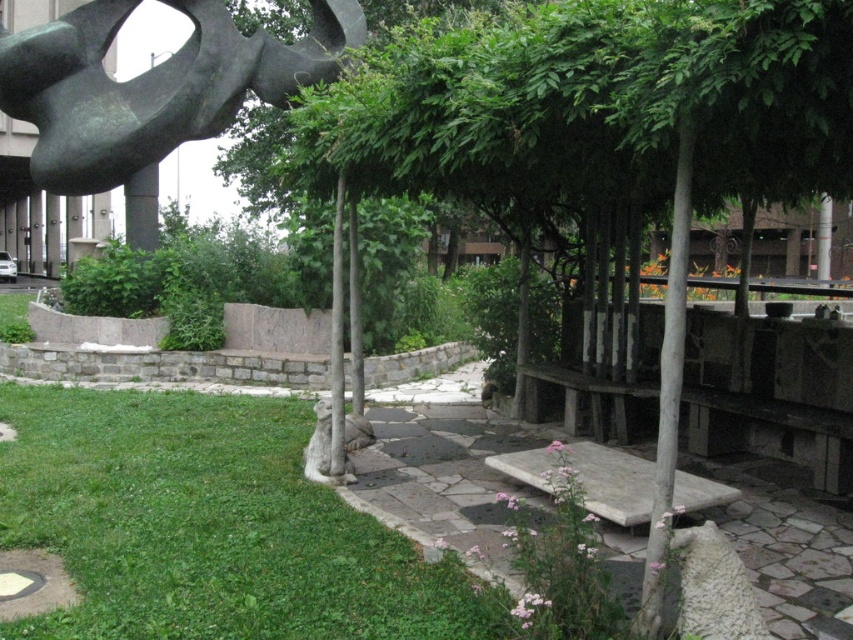
Question: In this image, where is green grass at lower left located relative to bronze sculpture at upper left?

Choices:
 (A) left
 (B) right

Answer: (B)

Question: Which point is farther to the camera?

Choices:
 (A) (161, 490)
 (B) (605, 490)

Answer: (A)

Question: Is green grass at lower left below bronze sculpture at upper left?

Choices:
 (A) no
 (B) yes

Answer: (B)

Question: Which point appears closest to the camera in this image?

Choices:
 (A) (674, 509)
 (B) (291, 449)

Answer: (A)

Question: Considering the relative positions of green grass at lower left and bronze sculpture at upper left in the image provided, where is green grass at lower left located with respect to bronze sculpture at upper left?

Choices:
 (A) right
 (B) left

Answer: (A)

Question: Which of the following is the closest to the observer?

Choices:
 (A) (167, 150)
 (B) (717, 500)

Answer: (B)